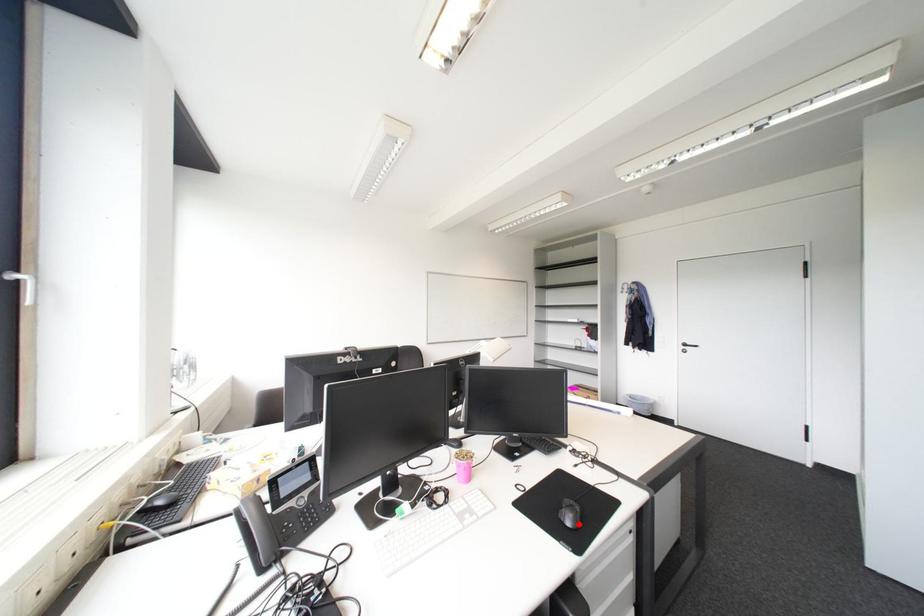
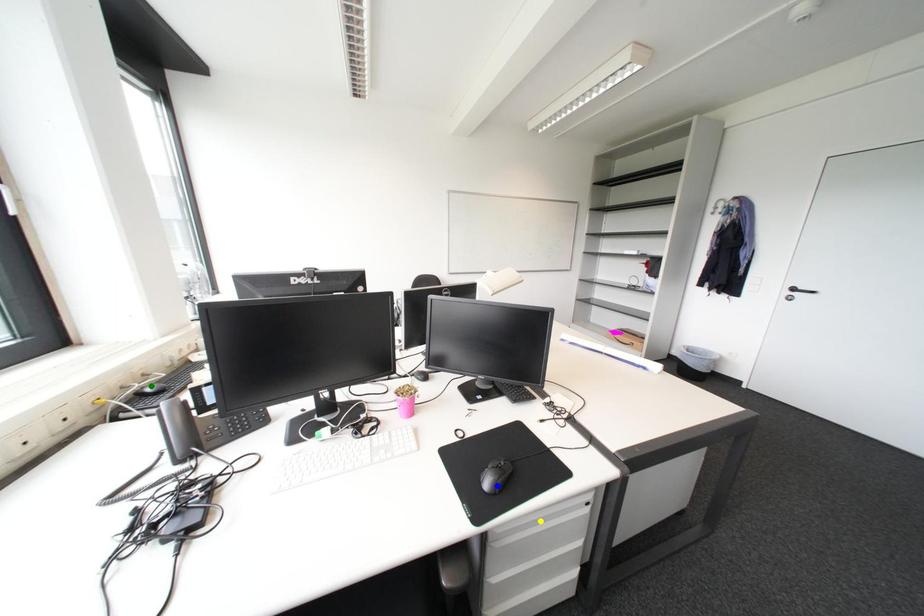
Question: I am providing you with two images of the same scene from different viewpoints. A red point is marked on the first image. You are given multiple points on the second image. Which spot in image 2 lines up with the point in image 1?

Choices:
 (A) green point
 (B) blue point
 (C) yellow point

Answer: (B)